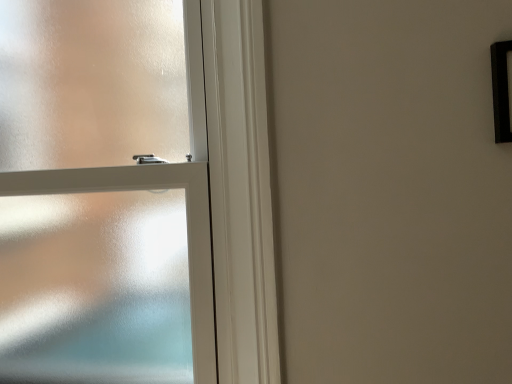
I want to click on frosted glass door at left, so click(x=103, y=194).

Measure the distance between point [63,269] and camera.

Point [63,269] and camera are 3.80 feet apart.

Describe the element at coordinates (103, 194) in the screenshot. I see `frosted glass door at left` at that location.

In order to face frosted glass door at left, should I rotate leftwards or rightwards?

To align with it, rotate left about 19.073°.

Find the location of a particular element. frosted glass door at left is located at coordinates (103, 194).